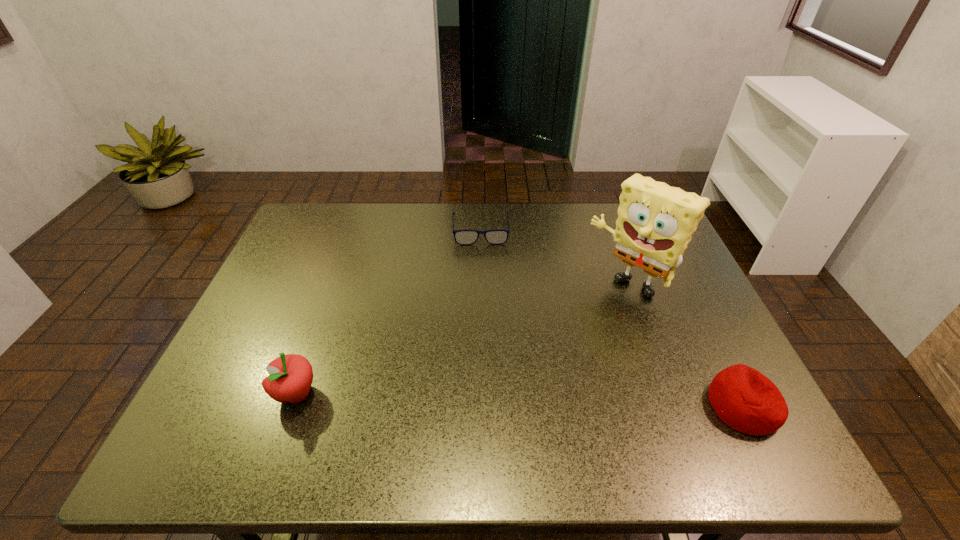
What are the coordinates of `apple` in the screenshot? It's located at (290, 377).

Where is `the second tallest object`? The image size is (960, 540). the second tallest object is located at coordinates (290, 377).

This screenshot has height=540, width=960. In order to click on beanbag in this screenshot , I will do `click(746, 400)`.

Identify the location of the shortest object. This screenshot has width=960, height=540. (462, 237).

You are a GUI agent. You are given a task and a screenshot of the screen. Output one action in this format:
    pyautogui.click(x=<x>, y=<y>)
    Task: Click on the farthest object
    The width and height of the screenshot is (960, 540).
    Given the screenshot: What is the action you would take?
    pyautogui.click(x=462, y=237)

You are a GUI agent. You are given a task and a screenshot of the screen. Output one action in this format:
    pyautogui.click(x=<x>, y=<y>)
    Task: Click on the second farthest object
    
    Given the screenshot: What is the action you would take?
    pyautogui.click(x=655, y=222)

Identify the location of the tallest object. The height and width of the screenshot is (540, 960). point(655,222).

This screenshot has height=540, width=960. In order to click on free region located 0.060m on the side where a bite is taken out of the second tallest object in this screenshot , I will do `click(246, 394)`.

Where is `vacant space positioned 0.080m on the side where a bite is taken out of the second tallest object`? The width and height of the screenshot is (960, 540). vacant space positioned 0.080m on the side where a bite is taken out of the second tallest object is located at coordinates (236, 394).

At what (x,y) coordinates should I click in order to perform the action: click on free space located on the front-facing side of the shortest object. Please return your answer as a coordinate pair (x, y). This screenshot has height=540, width=960. Looking at the image, I should click on (485, 310).